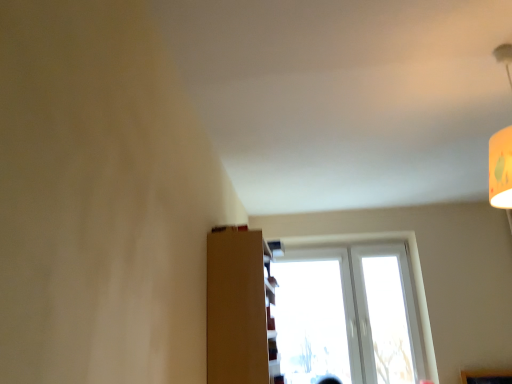
Question: Is brown matte shelf at center not inside white plastic window at center?

Choices:
 (A) yes
 (B) no

Answer: (A)

Question: From the image's perspective, is brown matte shelf at center on white plastic window at center?

Choices:
 (A) yes
 (B) no

Answer: (A)

Question: From a real-world perspective, is brown matte shelf at center physically above white plastic window at center?

Choices:
 (A) yes
 (B) no

Answer: (B)

Question: Would you consider brown matte shelf at center to be distant from white plastic window at center?

Choices:
 (A) no
 (B) yes

Answer: (B)

Question: From a real-world perspective, is brown matte shelf at center beneath white plastic window at center?

Choices:
 (A) no
 (B) yes

Answer: (B)

Question: Does brown matte shelf at center touch white plastic window at center?

Choices:
 (A) yes
 (B) no

Answer: (B)

Question: Can you confirm if white plastic window at center is bigger than brown matte shelf at center?

Choices:
 (A) yes
 (B) no

Answer: (A)

Question: From a real-world perspective, is white plastic window at center on top of brown matte shelf at center?

Choices:
 (A) yes
 (B) no

Answer: (A)

Question: Is the depth of white plastic window at center less than that of brown matte shelf at center?

Choices:
 (A) no
 (B) yes

Answer: (A)

Question: Is white plastic window at center not close to brown matte shelf at center?

Choices:
 (A) yes
 (B) no

Answer: (A)

Question: Does white plastic window at center turn towards brown matte shelf at center?

Choices:
 (A) yes
 (B) no

Answer: (A)

Question: Is white plastic window at center thinner than brown matte shelf at center?

Choices:
 (A) no
 (B) yes

Answer: (B)

Question: Is point (215, 317) positioned closer to the camera than point (284, 359)?

Choices:
 (A) farther
 (B) closer

Answer: (B)